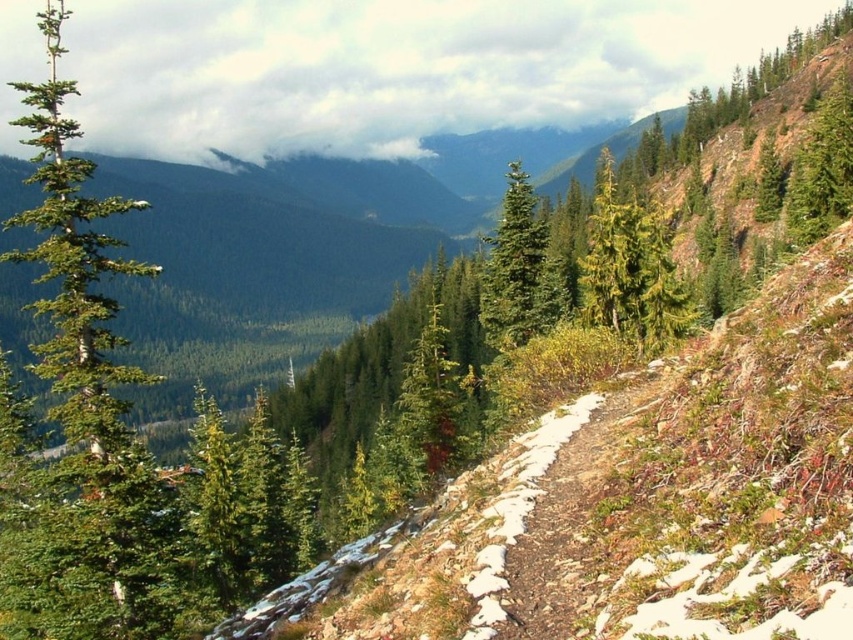
Question: Does green matte tree at left appear under green textured tree at upper right?

Choices:
 (A) no
 (B) yes

Answer: (A)

Question: Considering the real-world distances, which object is closest to the green textured tree at upper right?

Choices:
 (A) green matte tree at center
 (B) green matte tree at left

Answer: (A)

Question: Which point is farther to the camera?

Choices:
 (A) click(819, 141)
 (B) click(163, 611)

Answer: (A)

Question: Is green matte tree at left positioned behind green textured tree at upper right?

Choices:
 (A) no
 (B) yes

Answer: (A)

Question: Which point is farther to the camera?

Choices:
 (A) green matte tree at center
 (B) green matte tree at left

Answer: (A)

Question: Is green matte tree at left smaller than green matte tree at center?

Choices:
 (A) no
 (B) yes

Answer: (A)